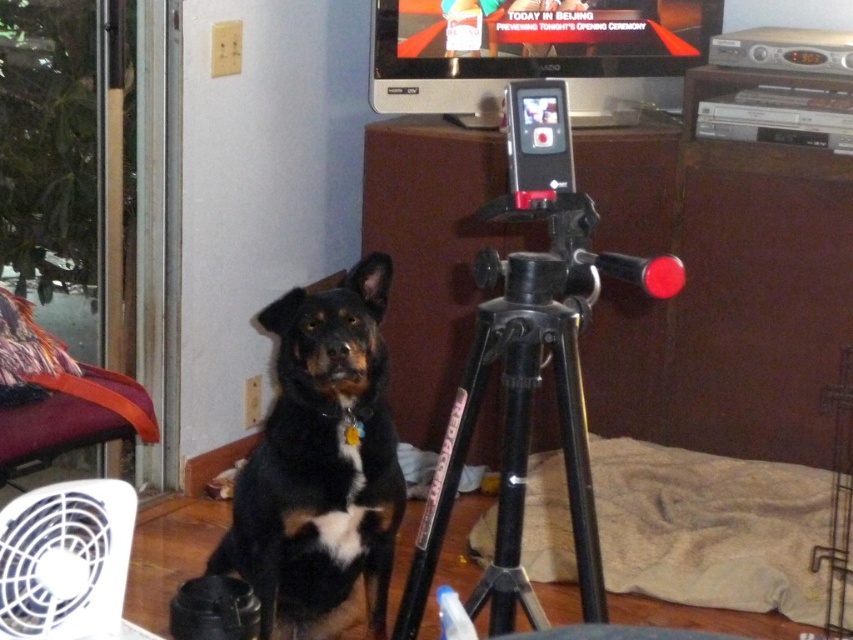
You are setting up a camera to take a photo of the black fur dog at center. The camera is mounted on the black matte tripod at center. To ensure the dog is in the frame, should you raise or lower the tripod?

The black fur dog at center is located below the black matte tripod at center. To ensure the dog is in the frame, you should lower the tripod so that the camera can capture the dog sitting on the floor.

You are a photographer setting up equipment in the living room. You need to adjust the height of the black matte tripod at center so that its top is level with the white plastic fan at lower left. Is the tripod currently taller or shorter than the fan?

The black matte tripod at center has a greater height compared to the white plastic fan at lower left, so the tripod is currently taller than the fan.

What are the coordinates of the black fur dog at center?

The black fur dog at center is located at point [320,465].